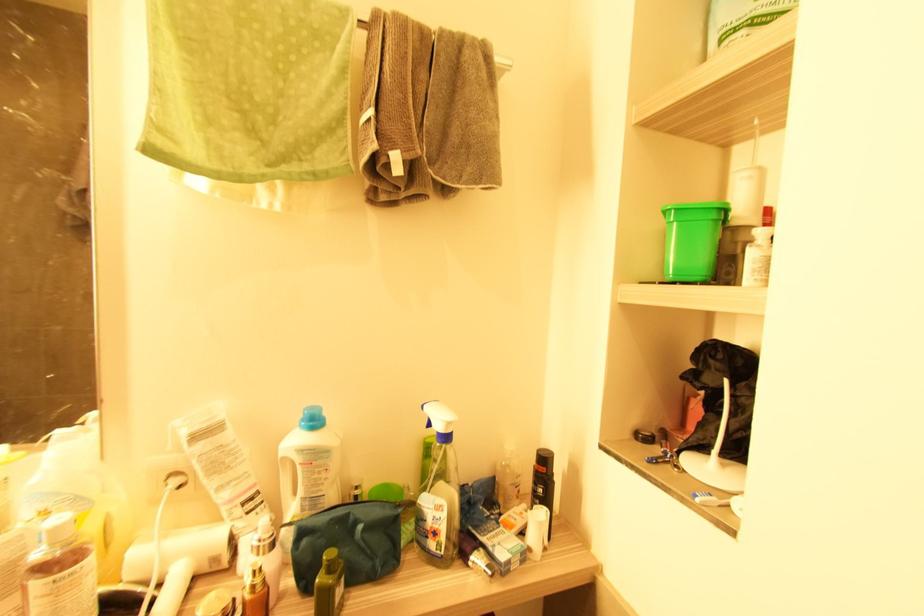
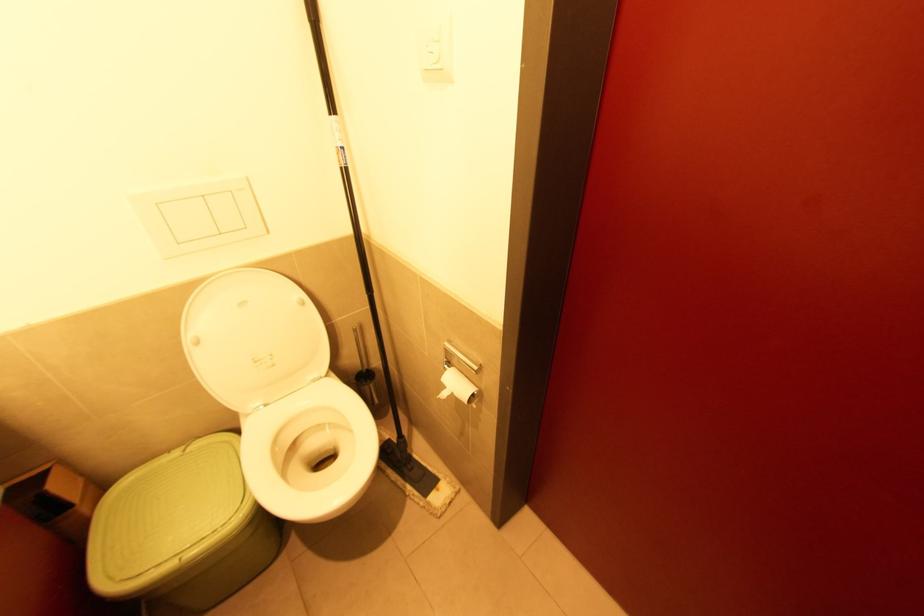
Looking at this image, the first image is from the beginning of the video and the second image is from the end. How did the camera likely rotate when shooting the video?

The rotation direction of the camera is right-down.